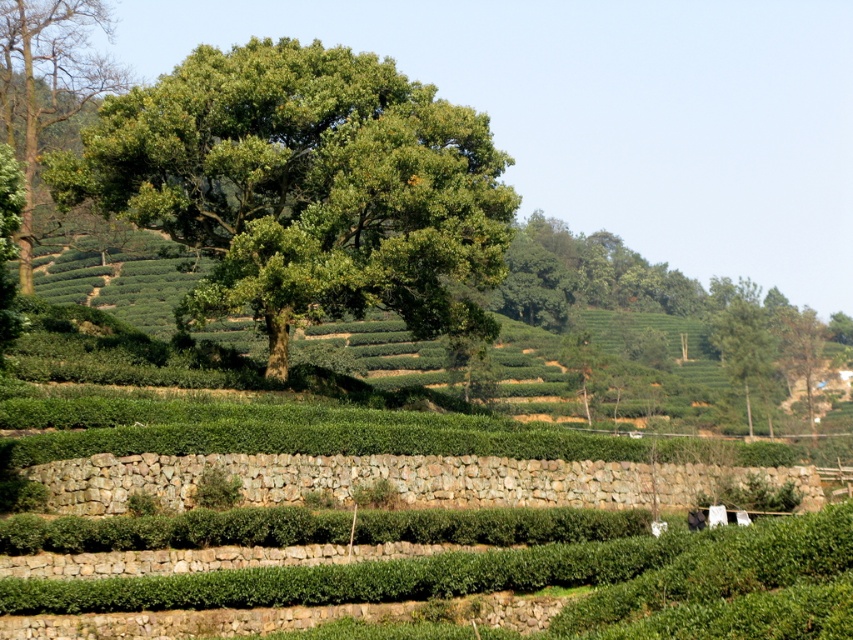
You are a hiker standing in the middle of the tea field and see the green leafy tree at upper left and the green leafy tree at upper right. Which tree is closer to you?

The green leafy tree at upper left is closer to you because it is positioned over the green leafy tree at upper right, indicating it is in a more forward plane in the scene.

You are planning to plant a new tree in this landscape. The new tree will be the same size as the green leafy tree at upper right. If you want to ensure there is enough space between the new tree and the existing green leafy tree at center, how should you position it?

Since the green leafy tree at center is wider than the green leafy tree at upper right, you should position the new tree further away from the green leafy tree at center to ensure adequate spacing.

You are an environmental scientist surveying the area. You observe two green leafy trees in the landscape. Which tree, the green leafy tree at center or the green leafy tree at upper right, is located more to the left?

The green leafy tree at center is positioned on the left side of green leafy tree at upper right, so the green leafy tree at center is more to the left.